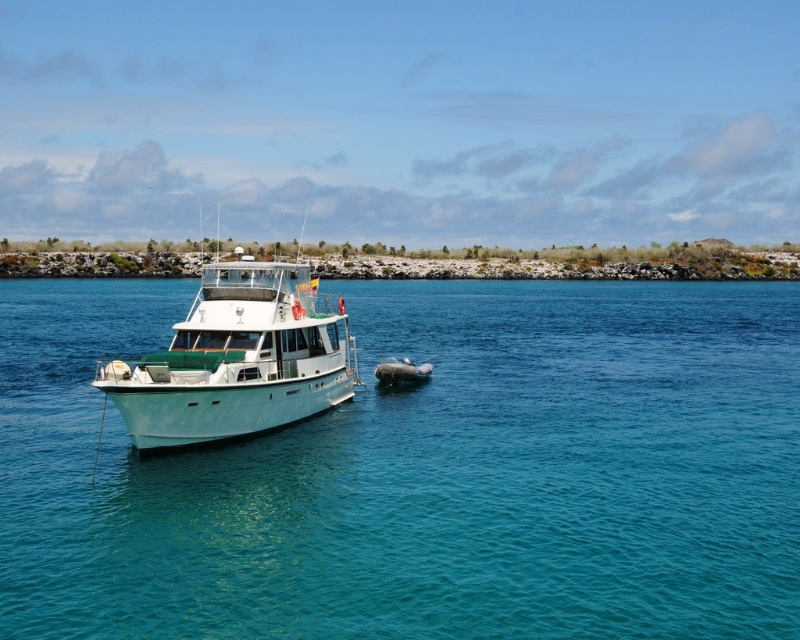
Does clear blue water at center appear over white glossy boat at left?

No.

Is clear blue water at center taller than white glossy boat at left?

No, clear blue water at center is not taller than white glossy boat at left.

Is point (626, 492) farther from camera compared to point (220, 292)?

That is False.

The image size is (800, 640). Identify the location of clear blue water at center. (420, 472).